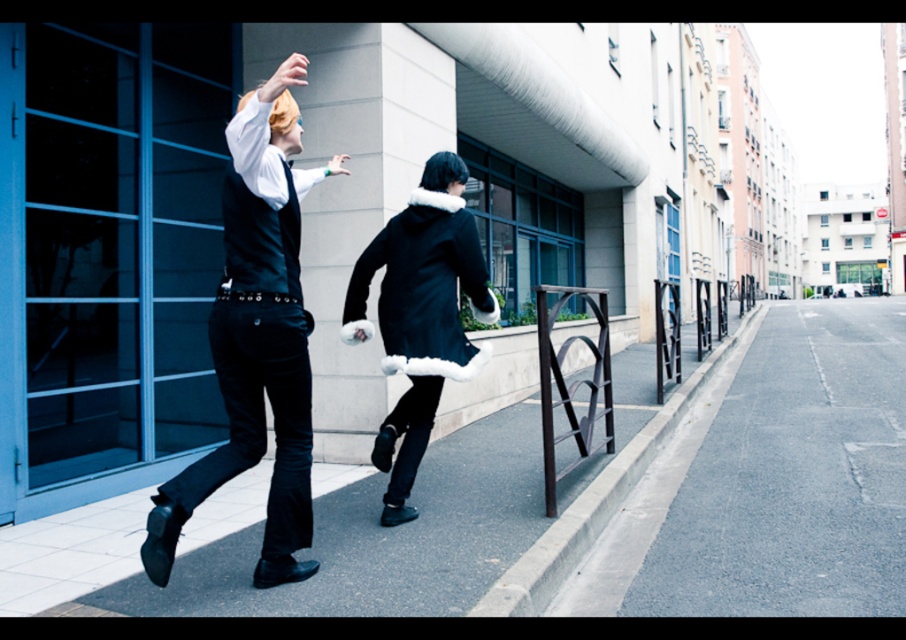
Question: Among these points, which one is nearest to the camera?

Choices:
 (A) (243, 163)
 (B) (716, 387)

Answer: (A)

Question: Is matte black suit at center above matte black vest at left?

Choices:
 (A) yes
 (B) no

Answer: (A)

Question: Does gray asphalt pavement at center appear under matte black suit at center?

Choices:
 (A) no
 (B) yes

Answer: (B)

Question: From the image, what is the correct spatial relationship of gray asphalt pavement at center in relation to matte black suit at center?

Choices:
 (A) below
 (B) above

Answer: (A)

Question: Considering the real-world distances, which object is farthest from the matte black suit at center?

Choices:
 (A) matte black vest at left
 (B) gray asphalt pavement at center
 (C) black asphalt at center
 (D) velvet black coat at center

Answer: (B)

Question: Which point appears farthest from the camera in this image?

Choices:
 (A) (834, 497)
 (B) (354, 310)
 (C) (268, 328)

Answer: (A)